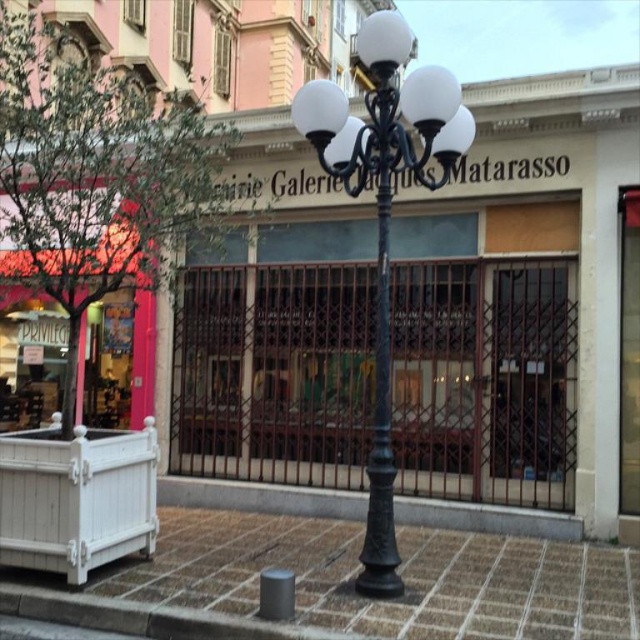
Question: Which object is positioned closest to the brick paved sidewalk at center?

Choices:
 (A) black metal street light at center
 (B) black metal streetlight at center

Answer: (A)

Question: Which is farther from the brick paved sidewalk at center?

Choices:
 (A) black metal street light at center
 (B) black metal streetlight at center

Answer: (B)

Question: Among these objects, which one is farthest from the camera?

Choices:
 (A) black metal streetlight at center
 (B) black metal street light at center

Answer: (A)

Question: Does black metal street light at center have a greater width compared to black metal streetlight at center?

Choices:
 (A) yes
 (B) no

Answer: (A)

Question: Is brick paved sidewalk at center thinner than black metal streetlight at center?

Choices:
 (A) yes
 (B) no

Answer: (A)

Question: Can you confirm if brick paved sidewalk at center is positioned below black metal street light at center?

Choices:
 (A) no
 (B) yes

Answer: (B)